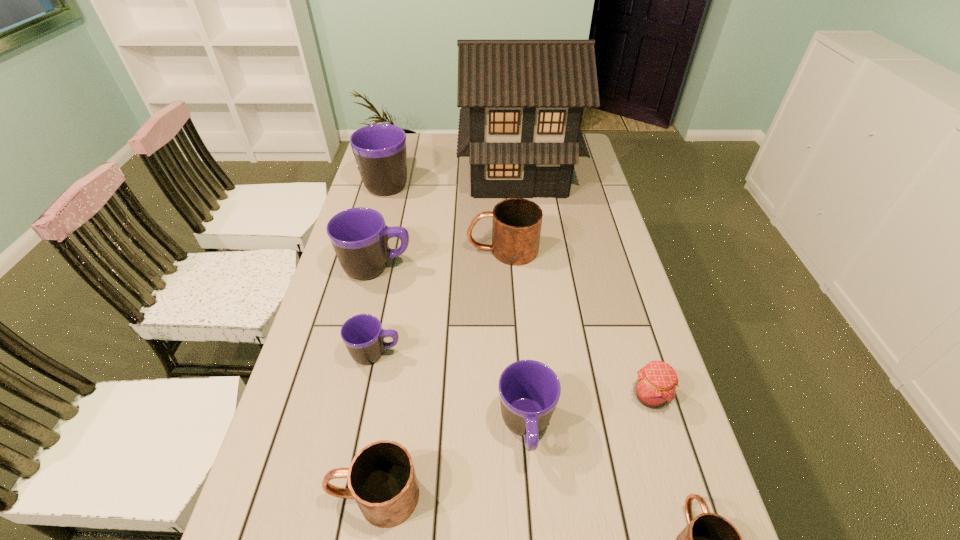
Locate an element on the screen. The image size is (960, 540). object at the far right corner is located at coordinates (522, 101).

Where is `vacant space at the far edge of the desktop`? vacant space at the far edge of the desktop is located at coordinates (447, 143).

At what (x,y) coordinates should I click in order to perform the action: click on free location at the left edge of the desktop. Please return your answer as a coordinate pair (x, y). The image size is (960, 540). Looking at the image, I should click on (295, 434).

The image size is (960, 540). Identify the location of free space at the right edge. point(600,291).

You are a GUI agent. You are given a task and a screenshot of the screen. Output one action in this format:
    pyautogui.click(x=<x>, y=<y>)
    Task: Click on the free space between the third smallest black mug and the dollhouse
    This screenshot has width=960, height=540.
    Given the screenshot: What is the action you would take?
    pyautogui.click(x=447, y=220)

Where is `empty space between the third nearest black mug and the jam`? Image resolution: width=960 pixels, height=540 pixels. empty space between the third nearest black mug and the jam is located at coordinates (513, 332).

Where is `vacant space that is in between the third smallest black mug and the dollhouse`? The height and width of the screenshot is (540, 960). vacant space that is in between the third smallest black mug and the dollhouse is located at coordinates (447, 220).

Locate an element on the screen. This screenshot has width=960, height=540. vacant point located between the third smallest black mug and the dollhouse is located at coordinates (447, 220).

The height and width of the screenshot is (540, 960). I want to click on free area in between the jam and the second rust mug from right to left, so click(x=576, y=323).

Identify the location of object that is the sixth closest to the second rust mug from right to left. (529, 390).